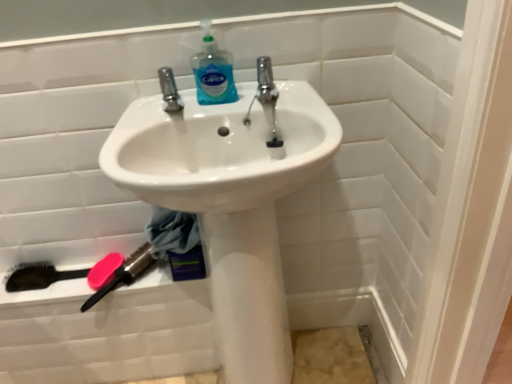
At what (x,y) coordinates should I click in order to perform the action: click on blue translucent liquid at upper center. Please return your answer as a coordinate pair (x, y). Looking at the image, I should click on (213, 71).

The height and width of the screenshot is (384, 512). I want to click on pink plastic brush at lower left, the second brush viewed from the left, so click(x=124, y=273).

Locate an element on the screen. The image size is (512, 384). blue translucent liquid at upper center is located at coordinates (213, 71).

The height and width of the screenshot is (384, 512). In order to click on sink below the blue translucent liquid at upper center (from the image's perspective) in this screenshot , I will do `click(231, 201)`.

Who is bigger, blue translucent liquid at upper center or white glossy sink at center?

white glossy sink at center.

In the scene shown: Measure the distance from blue translucent liquid at upper center to white glossy sink at center.

blue translucent liquid at upper center is 10.77 inches away from white glossy sink at center.

Which object is positioned more to the left, pink rubber soap at lower left or black bristle brush at lower left, placed as the 1th brush when sorted from left to right?

Positioned to the left is black bristle brush at lower left, placed as the 1th brush when sorted from left to right.

From the image's perspective, would you say pink rubber soap at lower left is positioned over black bristle brush at lower left, placed as the 1th brush when sorted from left to right?

Correct, pink rubber soap at lower left appears higher than black bristle brush at lower left, placed as the 1th brush when sorted from left to right, in the image.

Is pink rubber soap at lower left directly adjacent to black bristle brush at lower left, placed as the 2th brush when sorted from right to left?

No, pink rubber soap at lower left is not in contact with black bristle brush at lower left, placed as the 2th brush when sorted from right to left.

Between pink rubber soap at lower left and black bristle brush at lower left, placed as the 2th brush when sorted from right to left, which one has smaller width?

With smaller width is black bristle brush at lower left, placed as the 2th brush when sorted from right to left.

Consider the image. How different are the orientations of pink plastic brush at lower left, the second brush viewed from the left, and polished chrome tap at center in degrees?

The angle between the facing direction of pink plastic brush at lower left, the second brush viewed from the left, and the facing direction of polished chrome tap at center is 1.94 degrees.

Between point (146, 260) and point (274, 101), which one is positioned in front?

The point (274, 101) is in front.

From the image's perspective, which is below, pink plastic brush at lower left, the second brush viewed from the left, or polished chrome tap at center?

pink plastic brush at lower left, the second brush viewed from the left, from the image's perspective.

Is pink plastic brush at lower left, the first brush when ordered from right to left, oriented away from polished chrome tap at center?

No, pink plastic brush at lower left, the first brush when ordered from right to left,'s orientation is not away from polished chrome tap at center.

Is pink plastic brush at lower left, the first brush when ordered from right to left, touching blue translucent liquid at upper center?

pink plastic brush at lower left, the first brush when ordered from right to left, and blue translucent liquid at upper center are clearly separated.

Does point (126, 259) appear closer or farther from the camera than point (194, 57)?

Point (126, 259).

Which of these two, pink plastic brush at lower left, the second brush viewed from the left, or blue translucent liquid at upper center, stands taller?

blue translucent liquid at upper center.

Can you confirm if pink plastic brush at lower left, the second brush viewed from the left, is smaller than blue translucent liquid at upper center?

Incorrect, pink plastic brush at lower left, the second brush viewed from the left, is not smaller in size than blue translucent liquid at upper center.

From a real-world perspective, is black bristle brush at lower left, placed as the 1th brush when sorted from left to right, positioned above or below pink plastic brush at lower left, the second brush viewed from the left?

Clearly, from a real-world perspective, black bristle brush at lower left, placed as the 1th brush when sorted from left to right, is below pink plastic brush at lower left, the second brush viewed from the left.

Considering the points (58, 273) and (123, 268), which point is in front, point (58, 273) or point (123, 268)?

The point (123, 268) is in front.

Are black bristle brush at lower left, placed as the 1th brush when sorted from left to right, and pink plastic brush at lower left, the first brush when ordered from right to left, beside each other?

No, black bristle brush at lower left, placed as the 1th brush when sorted from left to right, is not beside pink plastic brush at lower left, the first brush when ordered from right to left.

Is pink plastic brush at lower left, the first brush when ordered from right to left, at the back of black bristle brush at lower left, placed as the 1th brush when sorted from left to right?

No, black bristle brush at lower left, placed as the 1th brush when sorted from left to right,'s orientation is not away from pink plastic brush at lower left, the first brush when ordered from right to left.

From the image's perspective, is pink rubber soap at lower left above or below pink plastic brush at lower left, the first brush when ordered from right to left?

Clearly, from the image's perspective, pink rubber soap at lower left is below pink plastic brush at lower left, the first brush when ordered from right to left.

Can you tell me how much pink rubber soap at lower left and pink plastic brush at lower left, the second brush viewed from the left, differ in facing direction?

The facing directions of pink rubber soap at lower left and pink plastic brush at lower left, the second brush viewed from the left, are 0.000179 degrees apart.

Which object is positioned more to the left, pink rubber soap at lower left or pink plastic brush at lower left, the first brush when ordered from right to left?

pink rubber soap at lower left.

Does point (98, 279) appear closer or farther from the camera than point (131, 259)?

Clearly, point (98, 279) is closer to the camera than point (131, 259).

Find the location of a particular element. cleaning product above the pink rubber soap at lower left (from a real-world perspective) is located at coordinates point(213,71).

Is pink rubber soap at lower left shorter than blue translucent liquid at upper center?

Indeed, pink rubber soap at lower left has a lesser height compared to blue translucent liquid at upper center.

From a real-world perspective, is pink rubber soap at lower left above or below blue translucent liquid at upper center?

From a real-world perspective, pink rubber soap at lower left is physically below blue translucent liquid at upper center.

Is pink rubber soap at lower left outside of blue translucent liquid at upper center?

That's correct, pink rubber soap at lower left is outside of blue translucent liquid at upper center.

In order to click on sink on the right of blue translucent liquid at upper center in this screenshot , I will do `click(231, 201)`.

I want to click on brush below the pink rubber soap at lower left (from a real-world perspective), so click(x=38, y=276).

Considering their positions, is polished chrome tap at center positioned further to blue translucent liquid at upper center than pink plastic brush at lower left, the first brush when ordered from right to left?

pink plastic brush at lower left, the first brush when ordered from right to left.

When comparing their distances from polished chrome tap at center, does white glossy sink at center or pink rubber soap at lower left seem further?

The object further to polished chrome tap at center is pink rubber soap at lower left.

Estimate the real-world distances between objects in this image. Which object is further from white glossy sink at center, pink rubber soap at lower left or blue translucent liquid at upper center?

Among the two, pink rubber soap at lower left is located further to white glossy sink at center.

Which object lies nearer to the anchor point pink plastic brush at lower left, the second brush viewed from the left, white glossy sink at center or pink rubber soap at lower left?

Among the two, pink rubber soap at lower left is located nearer to pink plastic brush at lower left, the second brush viewed from the left.

From the image, which object appears to be farther from pink rubber soap at lower left, polished chrome tap at center or black bristle brush at lower left, placed as the 1th brush when sorted from left to right?

polished chrome tap at center lies further to pink rubber soap at lower left than the other object.

Considering their positions, is white glossy sink at center positioned further to blue translucent liquid at upper center than pink rubber soap at lower left?

pink rubber soap at lower left is further to blue translucent liquid at upper center.

When comparing their distances from pink rubber soap at lower left, does pink plastic brush at lower left, the second brush viewed from the left, or white glossy sink at center seem further?

white glossy sink at center is positioned further to the anchor pink rubber soap at lower left.

Which object lies further to the anchor point pink plastic brush at lower left, the second brush viewed from the left, pink rubber soap at lower left or white glossy sink at center?

white glossy sink at center is further to pink plastic brush at lower left, the second brush viewed from the left.

Image resolution: width=512 pixels, height=384 pixels. Find the location of `tap between blue translucent liquid at upper center and white glossy sink at center in the up-down direction`. tap between blue translucent liquid at upper center and white glossy sink at center in the up-down direction is located at coordinates (265, 81).

Identify the location of sink between blue translucent liquid at upper center and pink plastic brush at lower left, the second brush viewed from the left, from top to bottom. (231, 201).

Where is `tap between blue translucent liquid at upper center and pink rubber soap at lower left from top to bottom`? tap between blue translucent liquid at upper center and pink rubber soap at lower left from top to bottom is located at coordinates (265, 81).

The image size is (512, 384). I want to click on brush that lies between blue translucent liquid at upper center and pink rubber soap at lower left from top to bottom, so click(124, 273).